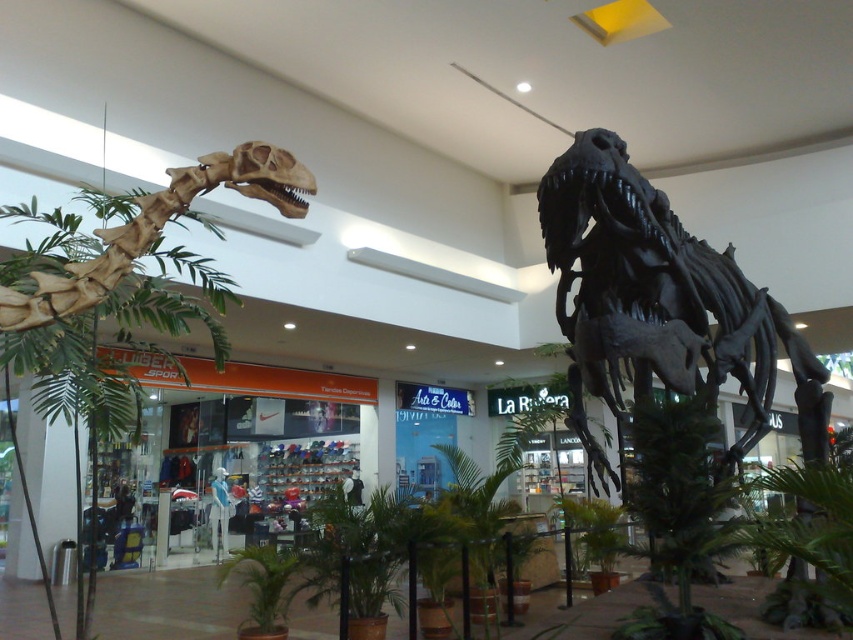
You are a museum curator planning to move the green leafy palm tree at left closer to the black matte skeleton at center. Based on their widths, will the palm tree fit next to the skeleton without overlapping?

The black matte skeleton at center is wider than the green leafy palm tree at left, so there should be enough space for the palm tree to fit next to the skeleton without overlapping.